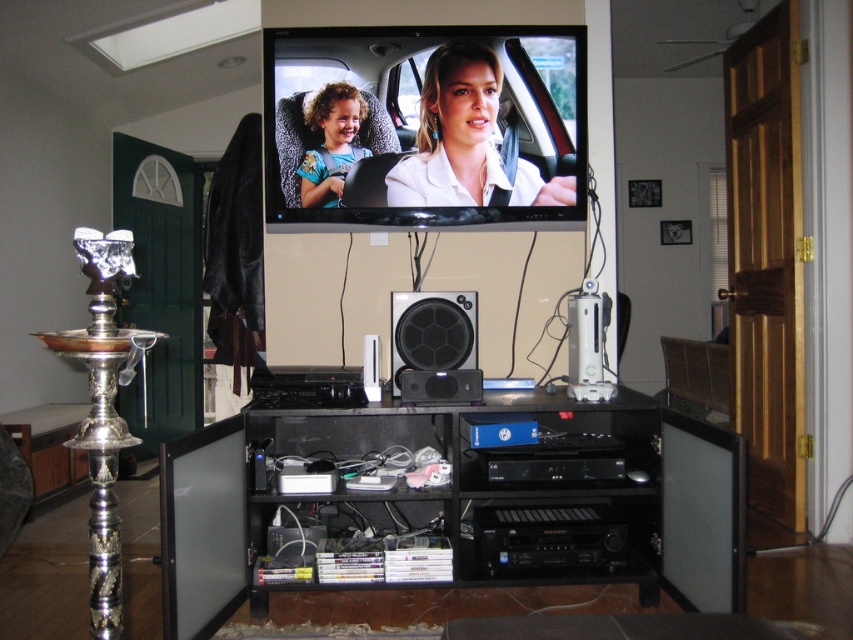
Measure the distance between point (170, 476) and camera.

Point (170, 476) and camera are 6.79 feet apart from each other.

Can you confirm if black plastic flat at lower left is positioned to the right of black matte speaker at center?

In fact, black plastic flat at lower left is to the left of black matte speaker at center.

Which is in front, point (206, 572) or point (413, 330)?

Point (206, 572) is in front.

You are a GUI agent. You are given a task and a screenshot of the screen. Output one action in this format:
    pyautogui.click(x=<x>, y=<y>)
    Task: Click on the black plastic flat at lower left
    
    Given the screenshot: What is the action you would take?
    pyautogui.click(x=202, y=529)

Can you confirm if matte black car at upper center is positioned below curly-haired child at center?

Incorrect, matte black car at upper center is not positioned below curly-haired child at center.

Can you confirm if matte black car at upper center is positioned to the right of curly-haired child at center?

Correct, you'll find matte black car at upper center to the right of curly-haired child at center.

The height and width of the screenshot is (640, 853). Identify the location of matte black car at upper center. (425, 124).

This screenshot has width=853, height=640. Describe the element at coordinates (466, 140) in the screenshot. I see `white glossy shirt at upper center` at that location.

Can you confirm if white glossy shirt at upper center is bigger than curly-haired child at center?

Correct, white glossy shirt at upper center is larger in size than curly-haired child at center.

Does point (403, 180) come closer to viewer compared to point (345, 152)?

No, it is behind (345, 152).

Where is `white glossy shirt at upper center`? This screenshot has height=640, width=853. white glossy shirt at upper center is located at coordinates (466, 140).